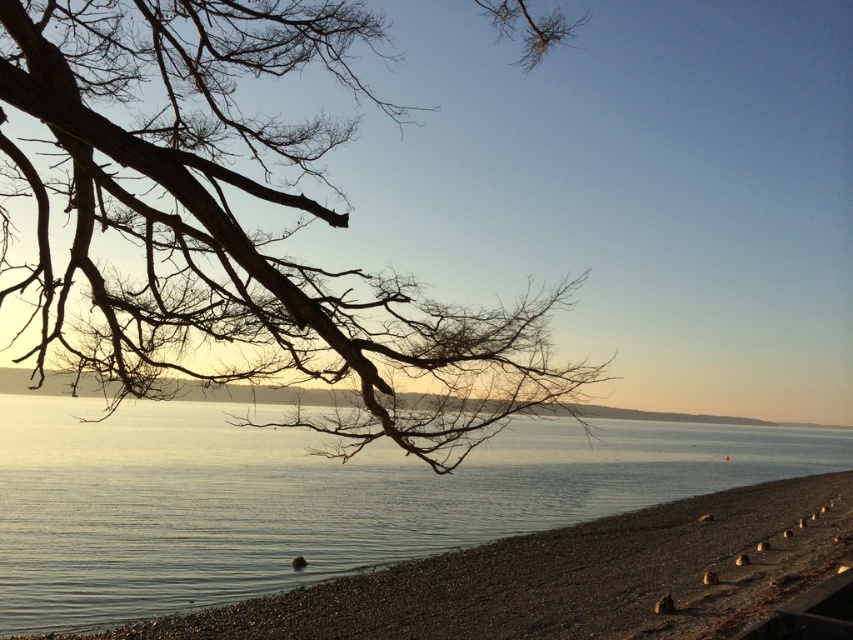
Question: Which of the following is the farthest from the observer?

Choices:
 (A) pyautogui.click(x=437, y=314)
 (B) pyautogui.click(x=70, y=490)

Answer: (B)

Question: Does brown/dry wood branches at upper left appear over transparent water at center?

Choices:
 (A) no
 (B) yes

Answer: (B)

Question: Which object is closer to the camera taking this photo?

Choices:
 (A) brown/dry wood branches at upper left
 (B) transparent water at center

Answer: (A)

Question: Can you confirm if brown/dry wood branches at upper left is positioned above transparent water at center?

Choices:
 (A) yes
 (B) no

Answer: (A)

Question: Which point is farther to the camera?

Choices:
 (A) (62, 33)
 (B) (660, 490)

Answer: (B)

Question: Can you confirm if brown/dry wood branches at upper left is wider than transparent water at center?

Choices:
 (A) yes
 (B) no

Answer: (B)